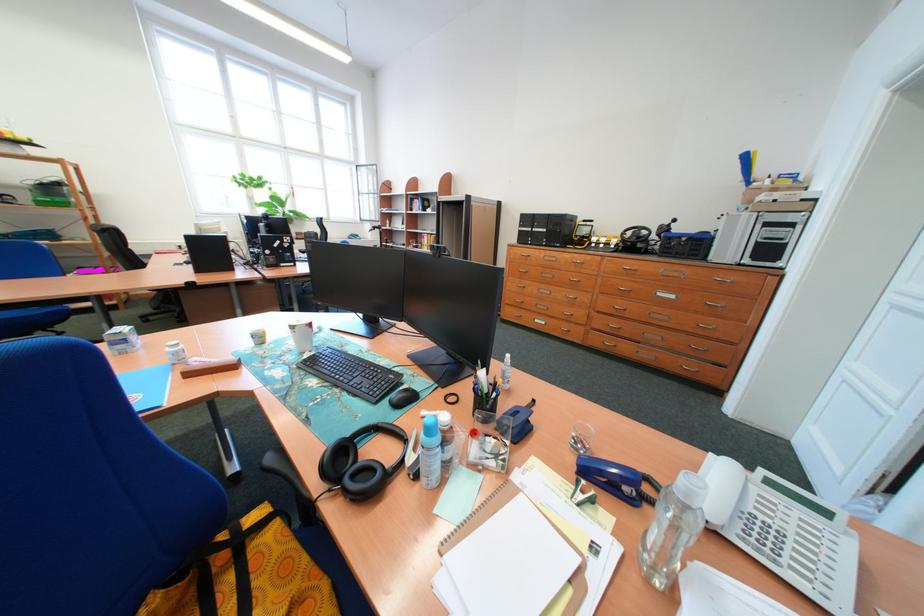
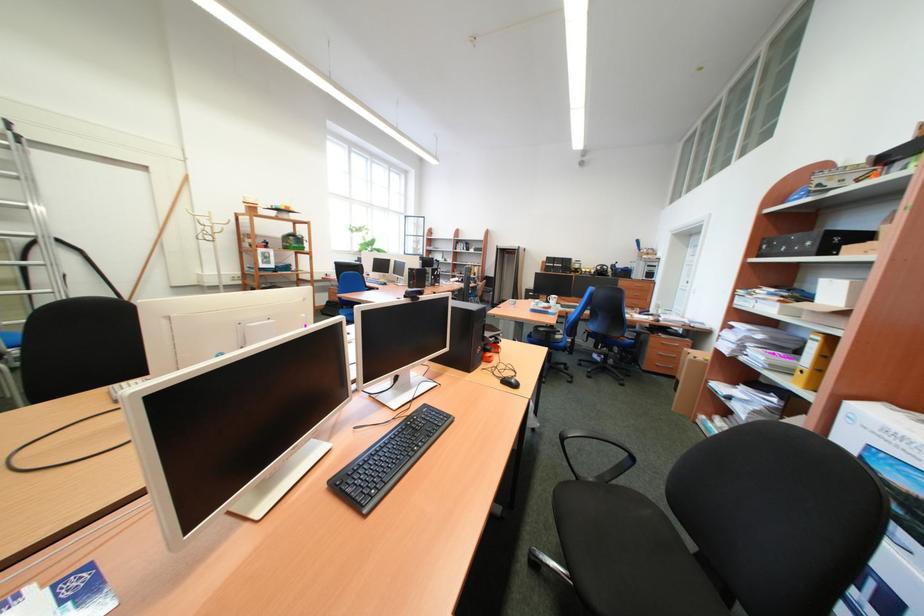
Which direction would the cameraman need to move to produce the second image?

The cameraman moved toward left, backward.